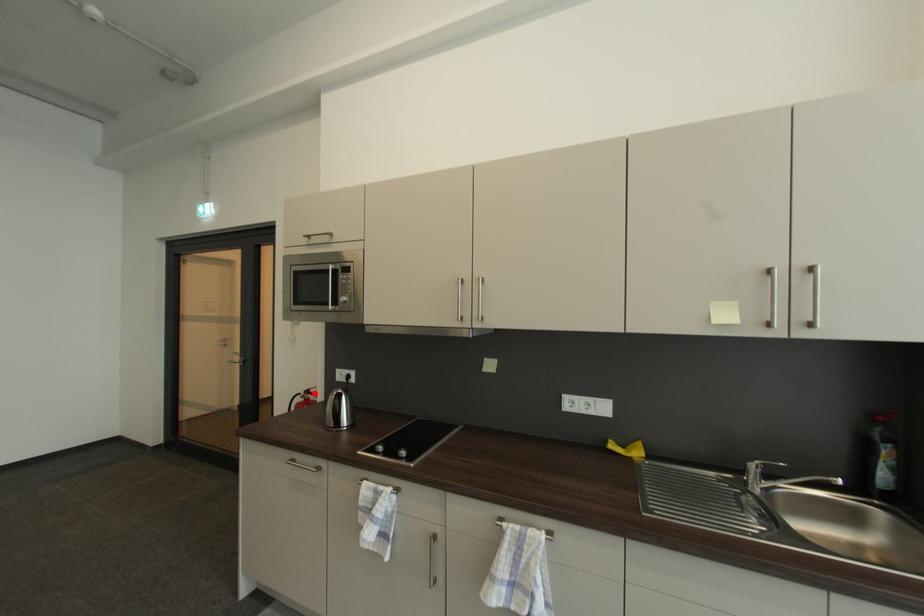
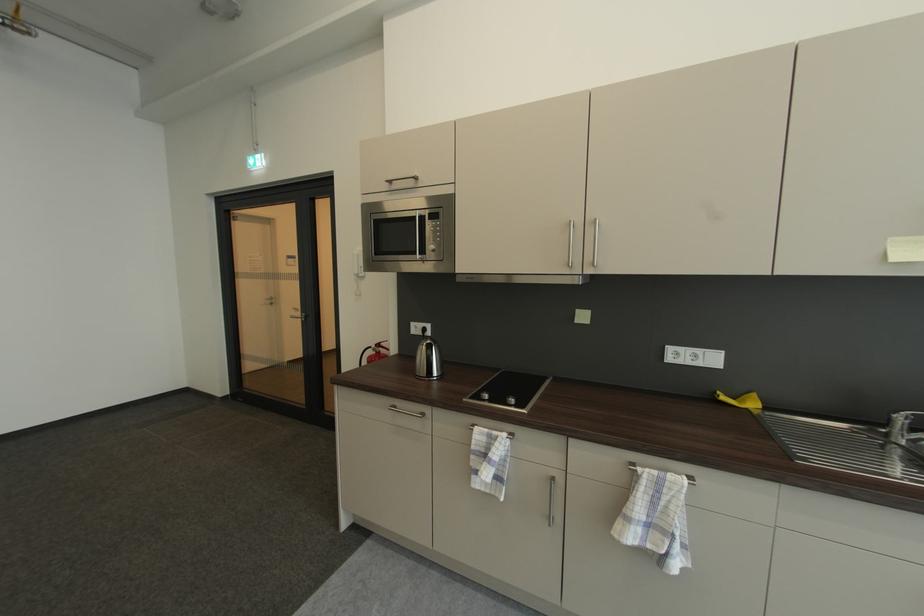
The point at the highlighted location is marked in the first image. Where is the corresponding point in the second image?

(384, 347)